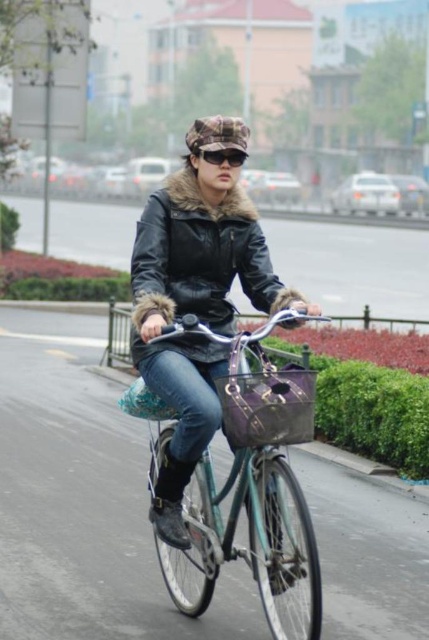
Question: From the image, what is the correct spatial relationship of teal metallic bicycle at center in relation to black matte sunglasses at center?

Choices:
 (A) right
 (B) left

Answer: (A)

Question: Which object is farther from the camera taking this photo?

Choices:
 (A) teal metallic bicycle at center
 (B) black matte sunglasses at center

Answer: (B)

Question: Which object is farther from the camera taking this photo?

Choices:
 (A) teal metallic bicycle at center
 (B) black matte sunglasses at center

Answer: (B)

Question: Is the position of teal metallic bicycle at center more distant than that of black matte sunglasses at center?

Choices:
 (A) no
 (B) yes

Answer: (A)

Question: Which point is farther to the camera?

Choices:
 (A) black matte sunglasses at center
 (B) teal metallic bicycle at center

Answer: (A)

Question: Does teal metallic bicycle at center have a smaller size compared to black matte sunglasses at center?

Choices:
 (A) no
 (B) yes

Answer: (A)